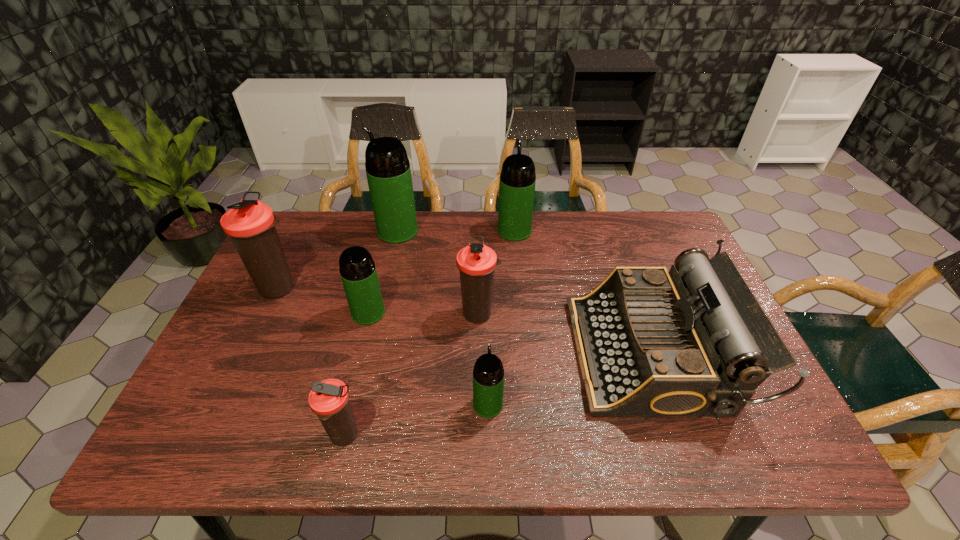
Find the location of a particular element. The width and height of the screenshot is (960, 540). vacant space located 0.300m on the keyboard of the rightmost object is located at coordinates (454, 354).

The width and height of the screenshot is (960, 540). I want to click on free space located 0.240m on the keyboard of the rightmost object, so click(478, 354).

Where is `blank space located on the keyboard of the rightmost object`? blank space located on the keyboard of the rightmost object is located at coordinates (417, 354).

Find the location of a particular element. vacant area located from the spout of the second green thermos bottle from right to left is located at coordinates (487, 305).

The width and height of the screenshot is (960, 540). Find the location of `free region located 0.210m from the spout of the second green thermos bottle from right to left`. free region located 0.210m from the spout of the second green thermos bottle from right to left is located at coordinates (487, 322).

The width and height of the screenshot is (960, 540). I want to click on vacant space located 0.090m from the spout of the second green thermos bottle from right to left, so click(488, 359).

You are a GUI agent. You are given a task and a screenshot of the screen. Output one action in this format:
    pyautogui.click(x=<x>, y=<y>)
    Task: Click on the free region located 0.200m on the back of the smallest brown thermos bottle
    
    Given the screenshot: What is the action you would take?
    (366, 345)

I want to click on typewriter that is at the near edge, so click(x=651, y=342).

The image size is (960, 540). I want to click on object located at the left edge, so click(x=250, y=224).

Identify the location of object that is at the right edge. The image size is (960, 540). (651, 342).